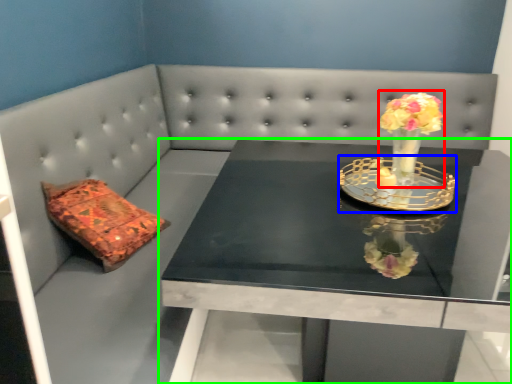
Question: Which object is the closest to the floral arrangement (highlighted by a red box)? Choose among these: candle holder (highlighted by a blue box) or table (highlighted by a green box).

Choices:
 (A) candle holder
 (B) table

Answer: (A)